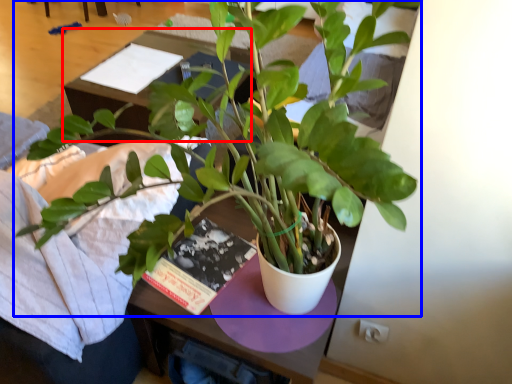
Question: Among these objects, which one is farthest to the camera, table (highlighted by a red box) or houseplant (highlighted by a blue box)?

Choices:
 (A) table
 (B) houseplant

Answer: (A)